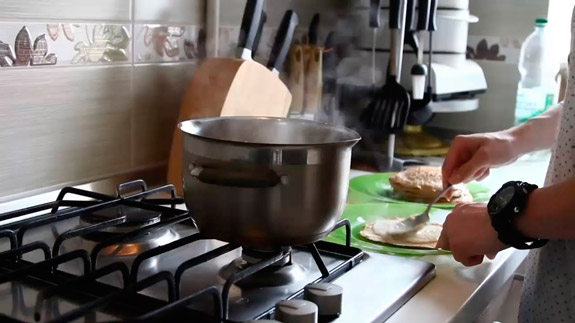
You are a GUI agent. You are given a task and a screenshot of the screen. Output one action in this format:
    pyautogui.click(x=<x>, y=<y>)
    Task: Click on the cooking oil bottle
    The width and height of the screenshot is (575, 323).
    Given the screenshot: What is the action you would take?
    pyautogui.click(x=539, y=57)